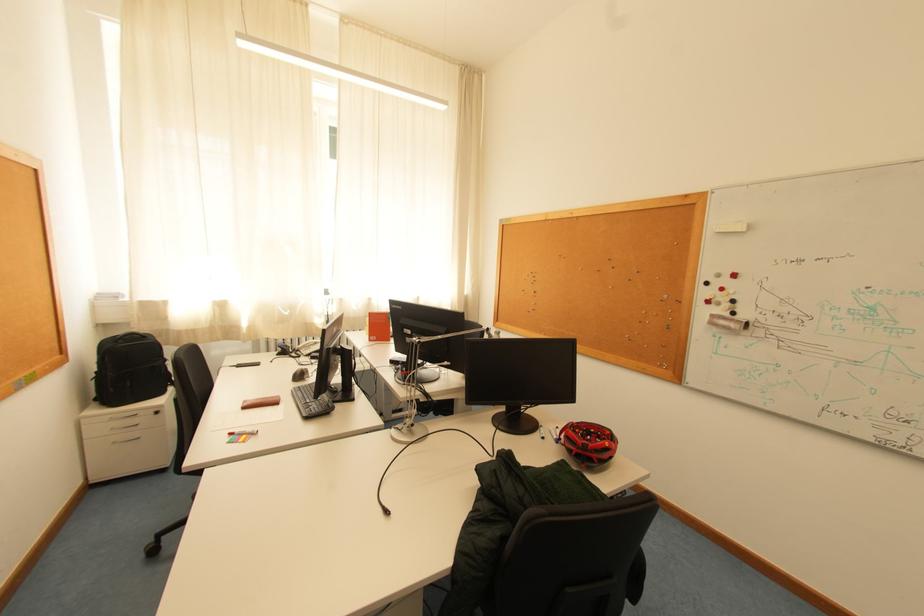
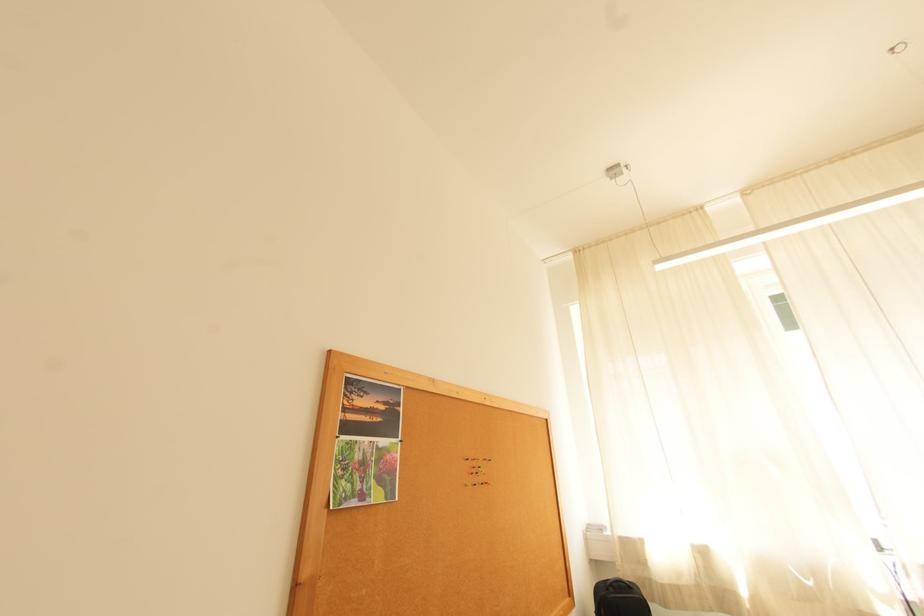
Where in the second image is the point corresponding to (129,342) from the first image?

(619, 591)